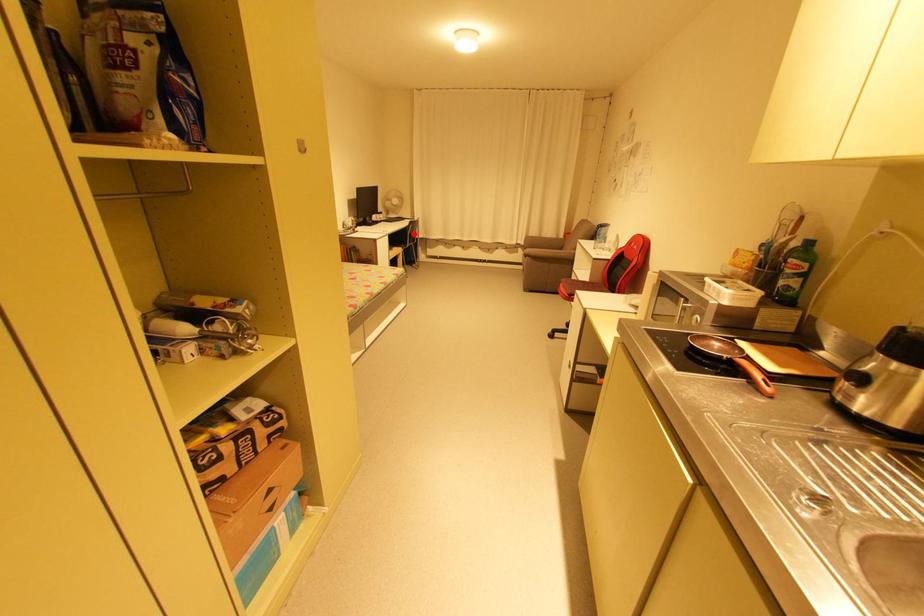
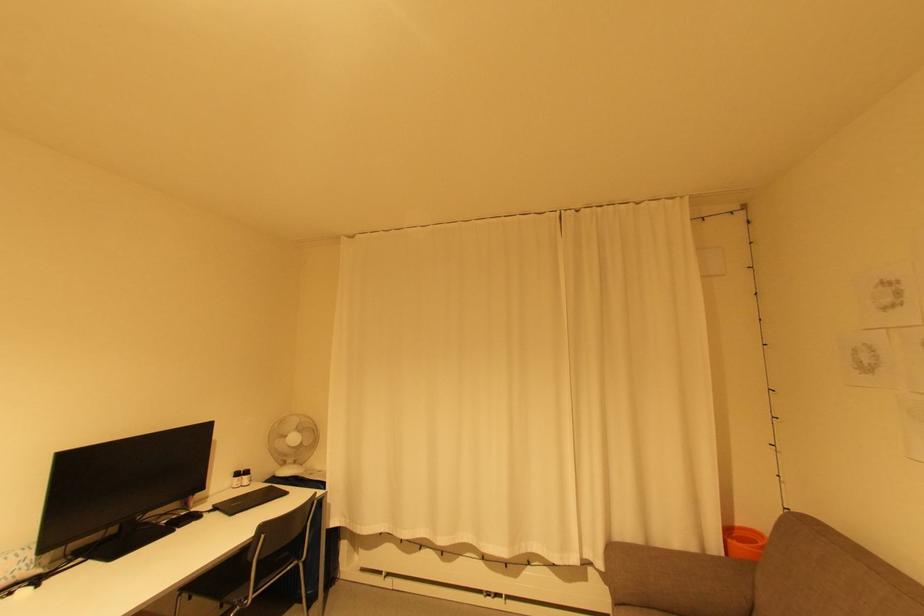
Question: A red point is marked in image1. In image2, is the corresponding 3D point closer to the camera or farther? Reply with the corresponding letter.

Choices:
 (A) The corresponding 3D point is closer.
 (B) The corresponding 3D point is farther.

Answer: (B)